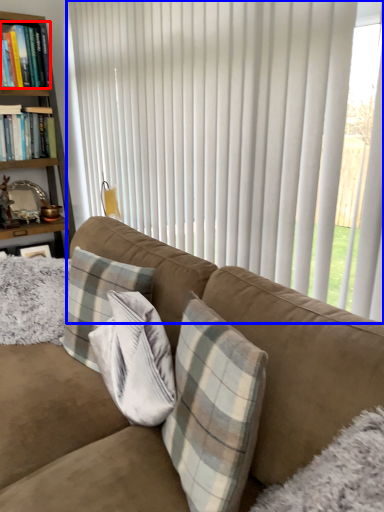
Question: Which object is closer to the camera taking this photo, book (highlighted by a red box) or curtain (highlighted by a blue box)?

Choices:
 (A) book
 (B) curtain

Answer: (B)